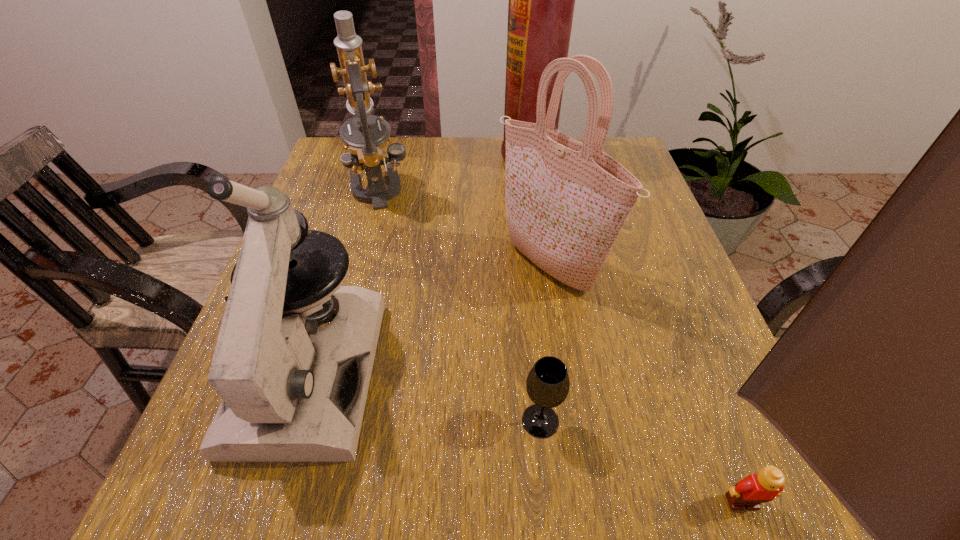
Where is `vacant space situated on the front of the shopping bag`? Image resolution: width=960 pixels, height=540 pixels. vacant space situated on the front of the shopping bag is located at coordinates (562, 343).

You are a GUI agent. You are given a task and a screenshot of the screen. Output one action in this format:
    pyautogui.click(x=<x>, y=<y>)
    Task: Click on the free space located 0.130m on the front of the farther microscope
    The width and height of the screenshot is (960, 540).
    Given the screenshot: What is the action you would take?
    pyautogui.click(x=360, y=251)

The image size is (960, 540). What are the coordinates of `blank space located on the back of the wineglass` in the screenshot? It's located at (531, 326).

Where is `fire extinguisher that is at the far edge`? The image size is (960, 540). fire extinguisher that is at the far edge is located at coordinates (541, 4).

Identify the location of microscope that is at the far edge. (366, 148).

Identify the location of microscope that is at the near edge. The image size is (960, 540). (291, 392).

Locate an element on the screen. The height and width of the screenshot is (540, 960). Lego that is at the near edge is located at coordinates (750, 492).

Find the location of `shopping bag present at the right edge`. shopping bag present at the right edge is located at coordinates click(x=566, y=202).

I want to click on Lego present at the right edge, so click(750, 492).

This screenshot has width=960, height=540. In order to click on object located in the far left corner section of the desktop in this screenshot , I will do `click(366, 148)`.